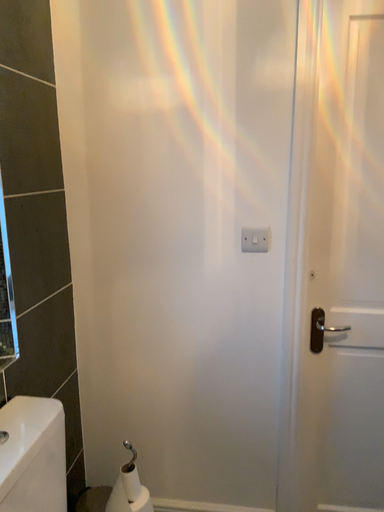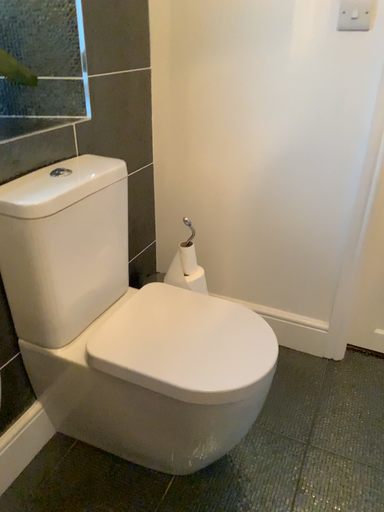
Question: How did the camera likely rotate when shooting the video?

Choices:
 (A) rotated left
 (B) rotated right

Answer: (A)